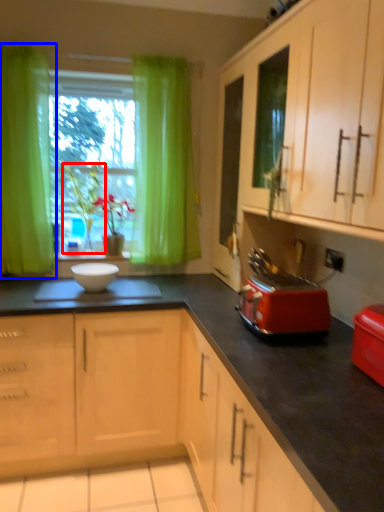
Question: Which of the following is the closest to the observer, plant (highlighted by a red box) or curtain (highlighted by a blue box)?

Choices:
 (A) plant
 (B) curtain

Answer: (B)